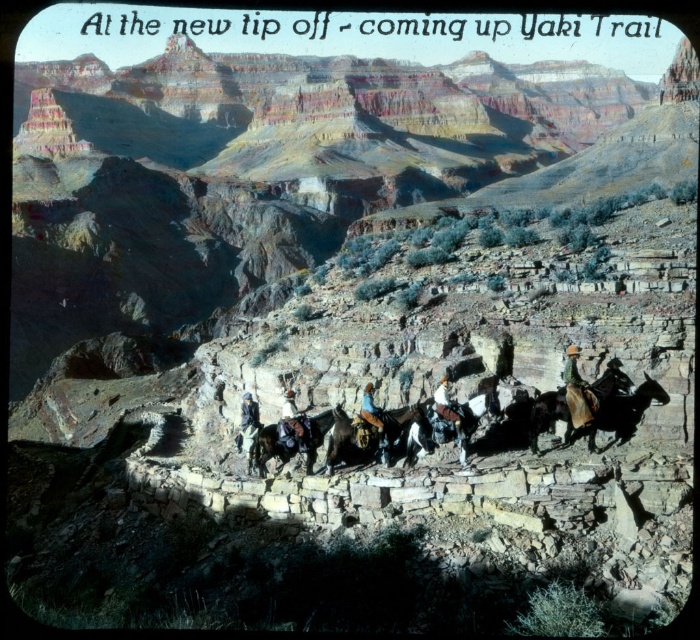
You are a photographer standing at the center of the rocky outcrop in the foreground. You want to take a photo of the shiny brown horse at center right. Which direction should you face to ensure the horse is in the frame?

You should face towards the center right direction to capture the shiny brown horse at center right in your photo.

You are a photographer standing at the camera position in the canyon scene. You want to capture a closeup of the brown leather saddle at center. Given that your telephoto lens can focus on objects up to 35 meters away, will you be able to get a clear closeup shot of the saddle?

The brown leather saddle at center is 36.63 meters away from the camera. Since the telephoto lens can only focus up to 35 meters, it will not be able to capture a clear closeup of the saddle.

You are a photographer standing at the edge of the canyon. You want to take a photo of the shiny brown horse at center right and the leather cowboy hat at center. Which object should you focus on first if you want to capture both in the same frame without moving your camera?

You should focus on the leather cowboy hat at center first because the shiny brown horse at center right is positioned to its right, so adjusting focus from the center to the right would ensure both are in the frame.